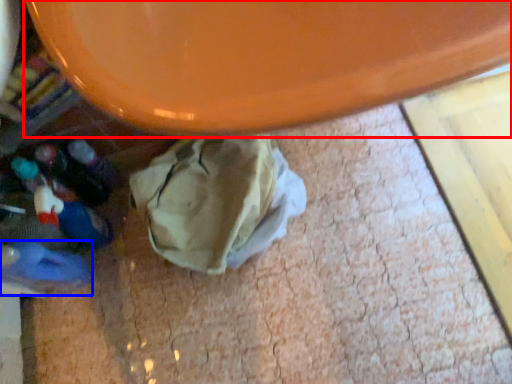
Question: Which object appears farthest to the camera in this image, round table (highlighted by a red box) or footwear (highlighted by a blue box)?

Choices:
 (A) round table
 (B) footwear

Answer: (B)